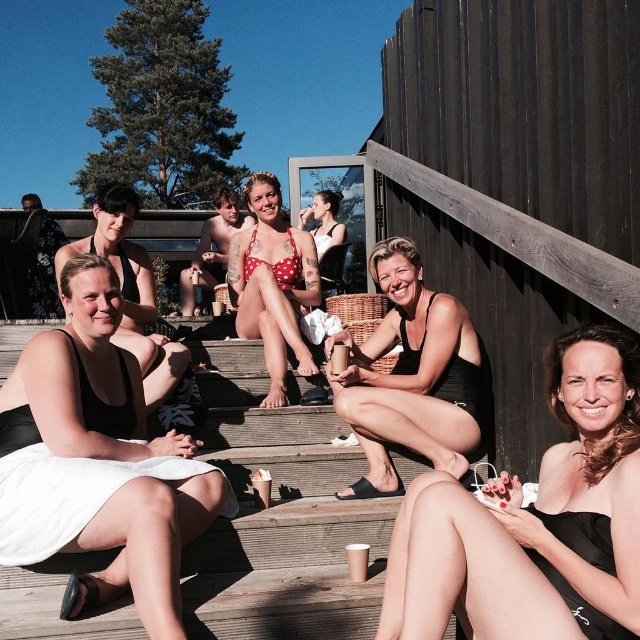
Is black matte towel at lower left bigger than polka dot bikini top at center?

Actually, black matte towel at lower left might be smaller than polka dot bikini top at center.

Describe the element at coordinates (99, 461) in the screenshot. The width and height of the screenshot is (640, 640). I see `black matte towel at lower left` at that location.

I want to click on black matte towel at lower left, so click(99, 461).

Is black matte swimsuit at lower right to the right of black matte swimsuit at left from the viewer's perspective?

Yes, black matte swimsuit at lower right is to the right of black matte swimsuit at left.

Consider the image. Is black matte swimsuit at lower right bigger than black matte swimsuit at left?

Incorrect, black matte swimsuit at lower right is not larger than black matte swimsuit at left.

Who is more forward, (579, 515) or (134, 202)?

Point (579, 515)

I want to click on black matte swimsuit at lower right, so click(534, 522).

Can you confirm if black matte swimsuit at center is positioned below polka dot bikini top at center?

Indeed, black matte swimsuit at center is positioned under polka dot bikini top at center.

Is black matte swimsuit at center smaller than polka dot bikini top at center?

Yes, black matte swimsuit at center is smaller than polka dot bikini top at center.

Does point (464, 374) lie behind point (250, 280)?

No, (464, 374) is closer to viewer.

The height and width of the screenshot is (640, 640). I want to click on black matte swimsuit at center, so click(x=410, y=376).